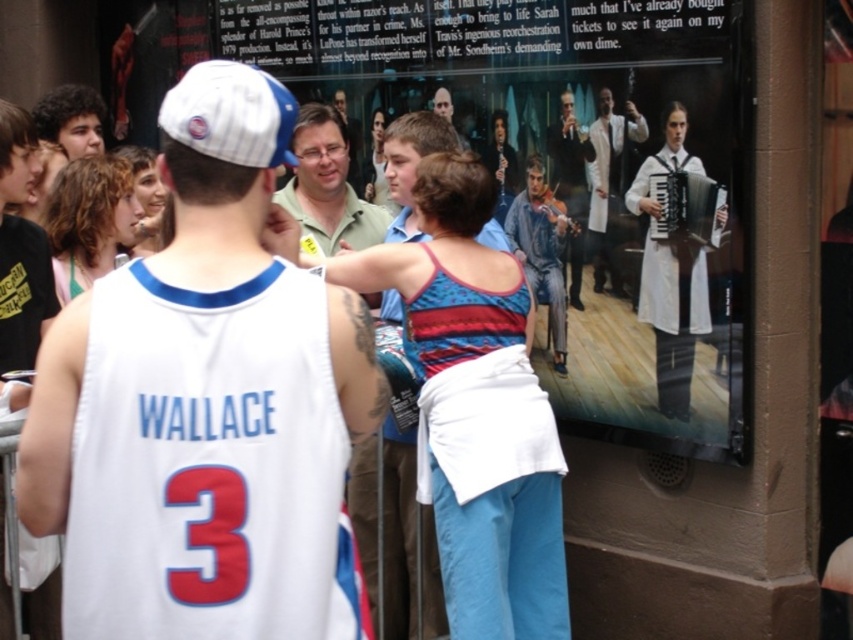
Question: Estimate the real-world distances between objects in this image. Which object is closer to the smooth brown hair at center?

Choices:
 (A) white cloth accordion at right
 (B) white lab coat at center
 (C) matte white poster at center
 (D) light brown wood violin at center

Answer: (C)

Question: Which point is closer to the camera taking this photo?

Choices:
 (A) (581, 184)
 (B) (144, 621)

Answer: (B)

Question: Is white jersey at center positioned at the back of smooth brown hair at center?

Choices:
 (A) yes
 (B) no

Answer: (B)

Question: From the image, what is the correct spatial relationship of matte white poster at center in relation to smooth brown hair at center?

Choices:
 (A) above
 (B) below

Answer: (A)

Question: Is matte white poster at center to the right of white fabric baseball cap at upper center from the viewer's perspective?

Choices:
 (A) no
 (B) yes

Answer: (B)

Question: Which object is farther from the camera taking this photo?

Choices:
 (A) white cloth accordion at right
 (B) light brown wood violin at center
 (C) white fabric baseball cap at upper center

Answer: (B)